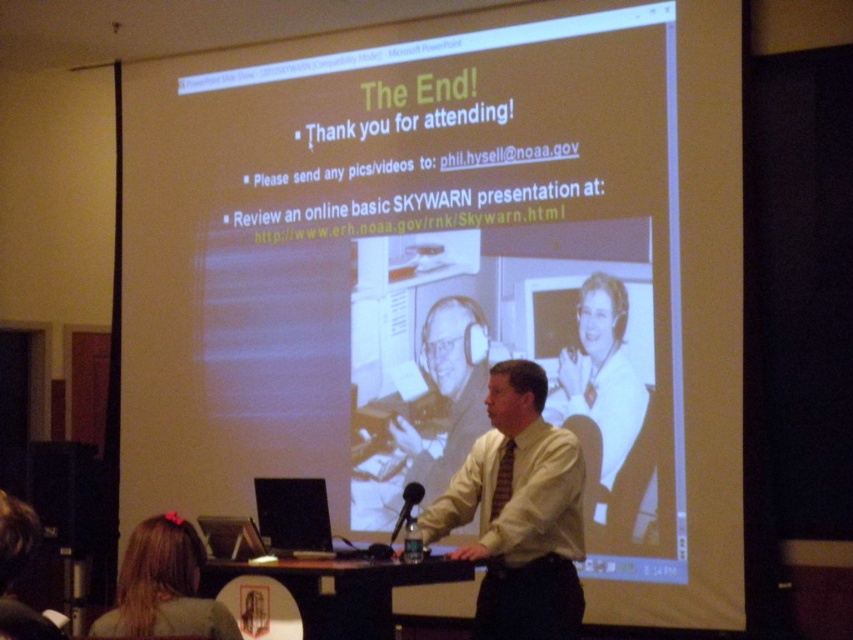
You are an attendee at this presentation and want to know which object at the center is narrower between the striped fabric tie at center and the black plastic microphone at center. Which one is it?

The striped fabric tie at center is thinner than the black plastic microphone at center, so the striped fabric tie at center is narrower.

You are an attendee at the presentation and need to take a photo of the slide. Since the white matte projection screen at center is much taller than the striped fabric tie at center, will the entire slide fit in your phone camera viewfinder if you focus on the screen?

Yes, the entire slide will fit in your phone camera viewfinder because the white matte projection screen at center is much taller than the striped fabric tie at center, ensuring sufficient vertical space to capture the entire slide.